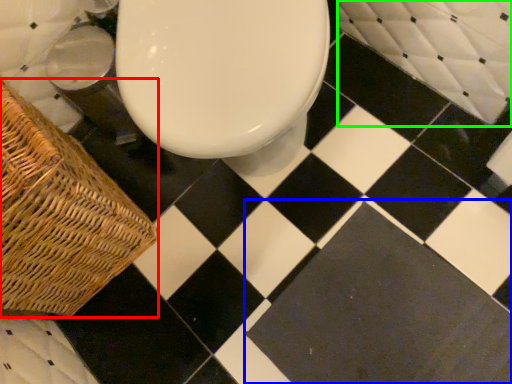
Question: Considering the real-world distances, which object is closest to picnic basket (highlighted by a red box)? square (highlighted by a blue box) or bath (highlighted by a green box).

Choices:
 (A) square
 (B) bath

Answer: (A)